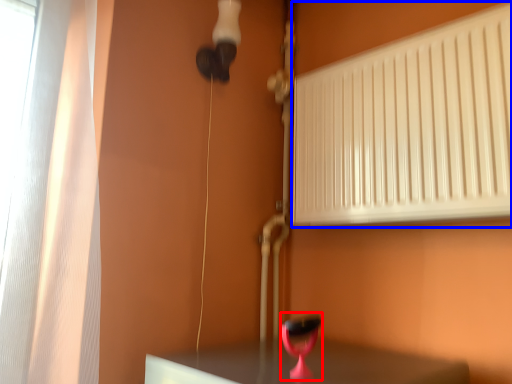
Question: Which point is further to the camera, table lamp (highlighted by a red box) or radiator (highlighted by a blue box)?

Choices:
 (A) table lamp
 (B) radiator

Answer: (B)